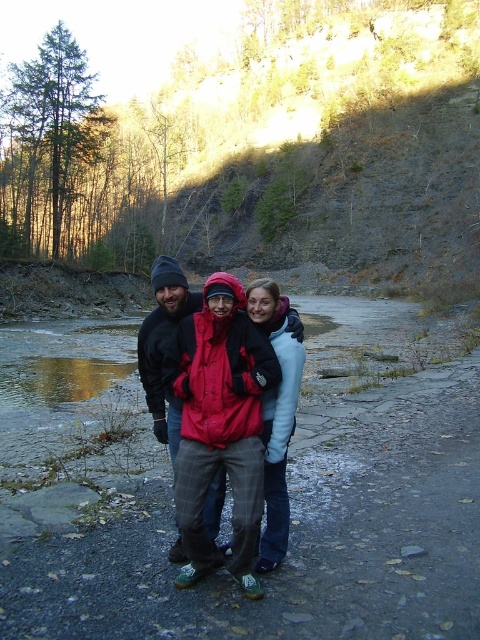
Does matte red jacket at center have a lesser height compared to light blue fleece jacket at center?

No, matte red jacket at center is not shorter than light blue fleece jacket at center.

Is matte red jacket at center smaller than light blue fleece jacket at center?

No.

This screenshot has height=640, width=480. What do you see at coordinates (207, 408) in the screenshot?
I see `matte red jacket at center` at bounding box center [207, 408].

At what (x,y) coordinates should I click in order to perform the action: click on matte red jacket at center. Please return your answer as a coordinate pair (x, y). The image size is (480, 640). Looking at the image, I should click on (207, 408).

Does light blue fleece jacket at center lie behind plaid woolen pants at center?

No, light blue fleece jacket at center is in front of plaid woolen pants at center.

Is light blue fleece jacket at center wider than plaid woolen pants at center?

No.

Based on the photo, who is more forward, (290, 348) or (168, 419)?

Point (290, 348) is in front.

This screenshot has width=480, height=640. I want to click on light blue fleece jacket at center, so click(x=276, y=413).

From the picture: Can you confirm if matte red jacket at center is positioned above plaid woolen pants at center?

No, matte red jacket at center is not above plaid woolen pants at center.

Is point (196, 465) positioned in front of point (164, 420)?

Yes, it is.

Identify the location of matte red jacket at center. The height and width of the screenshot is (640, 480). (207, 408).